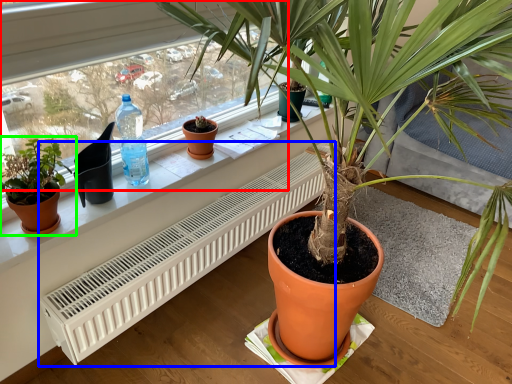
Question: Considering the real-world distances, which object is farthest from bay window (highlighted by a red box)? air conditioner (highlighted by a blue box) or houseplant (highlighted by a green box)?

Choices:
 (A) air conditioner
 (B) houseplant

Answer: (B)